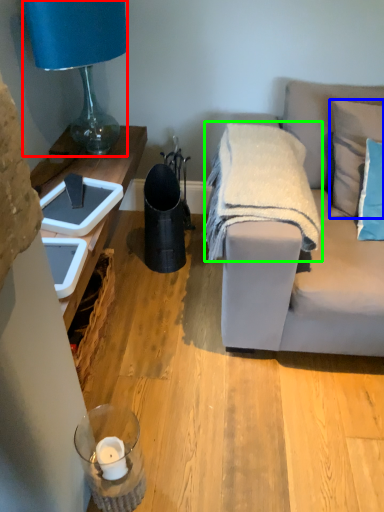
Question: Considering the real-world distances, which object is closest to lamp (highlighted by a red box)? pillow (highlighted by a blue box) or blanket (highlighted by a green box).

Choices:
 (A) pillow
 (B) blanket

Answer: (B)